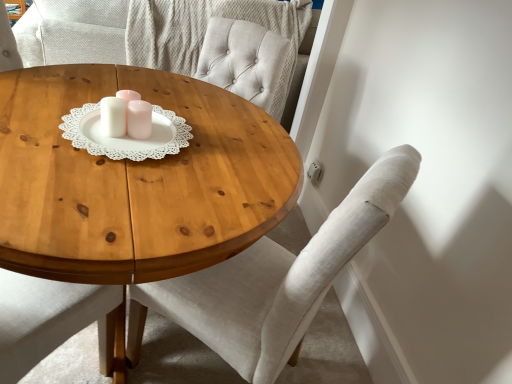
Question: Is white glossy candle holder at center inside the boundaries of wooden coffee table at center, or outside?

Choices:
 (A) inside
 (B) outside

Answer: (B)

Question: From their relative heights in the image, would you say white glossy candle holder at center is taller or shorter than wooden coffee table at center?

Choices:
 (A) tall
 (B) short

Answer: (B)

Question: Based on their relative distances, which object is nearer to the light gray fabric chair at center?

Choices:
 (A) wooden coffee table at center
 (B) white glossy candle holder at center

Answer: (A)

Question: Based on their relative distances, which object is farther from the white glossy candle holder at center?

Choices:
 (A) wooden coffee table at center
 (B) light gray fabric chair at center

Answer: (B)